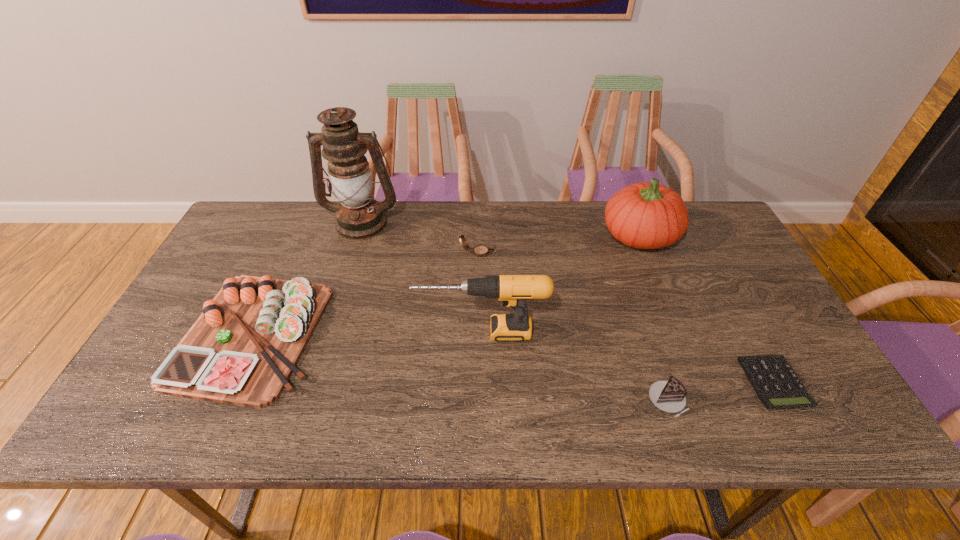
Image resolution: width=960 pixels, height=540 pixels. I want to click on vacant space located on the handle side of the drill, so click(x=268, y=332).

Find the location of `free region located 0.160m on the handle side of the drill`. free region located 0.160m on the handle side of the drill is located at coordinates (354, 332).

The image size is (960, 540). I want to click on free location located on the right of the platter, so click(x=401, y=335).

Locate an element on the screen. free location located on the face of the compass is located at coordinates (536, 252).

At what (x,y) coordinates should I click in order to perform the action: click on free space located 0.080m on the back of the chocolate cake. Please return your answer as a coordinate pair (x, y). The height and width of the screenshot is (540, 960). Looking at the image, I should click on (652, 354).

The height and width of the screenshot is (540, 960). In order to click on free spot located 0.280m on the back of the calculator in this screenshot , I will do `click(716, 276)`.

This screenshot has height=540, width=960. Identify the location of lantern located in the far edge section of the desktop. (359, 217).

Locate an element on the screen. pumpkin positioned at the far edge is located at coordinates (647, 215).

Locate an element on the screen. Image resolution: width=960 pixels, height=540 pixels. compass present at the far edge is located at coordinates (480, 250).

This screenshot has width=960, height=540. I want to click on platter that is at the near edge, so click(x=242, y=350).